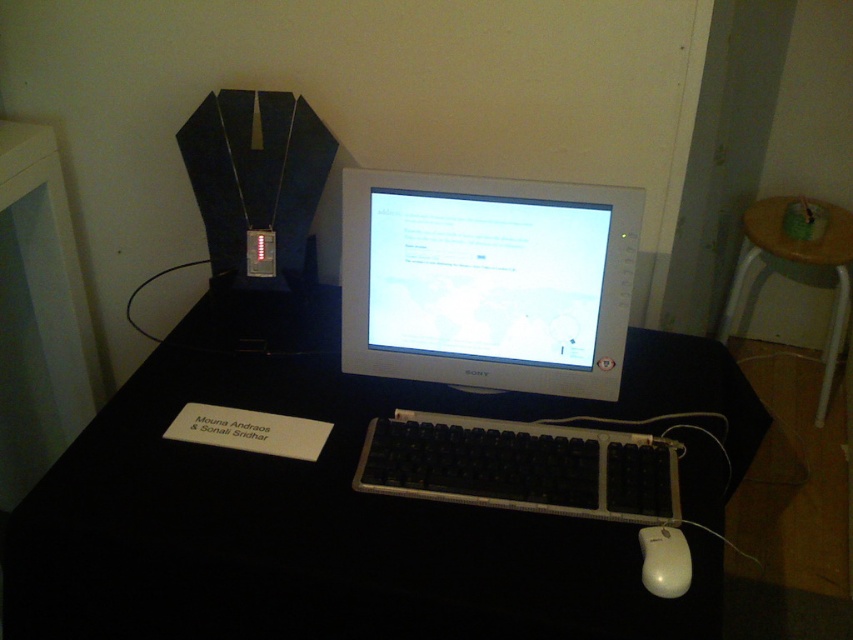
You are organizing your desk and need to move the white plastic mouse at lower right closer to the wooden table at right. Is the mouse currently positioned below the table or to the side of it?

The wooden table at right is above the white plastic mouse at lower right, so the mouse is positioned below the table.

You are sitting at the workspace and want to reach both the point at coordinates point(704, 358) and point(492, 497). Which point is closer to you?

Point(704, 358) is closer to you because it is further to the viewer than point(492, 497).

You are organizing your workspace and need to place a new item on the black plastic computer desk at center. Considering the size of the desk compared to the black plastic keyboard at center, will there be enough space for the item if it is the same size as the keyboard?

The black plastic computer desk at center is larger in size than the black plastic keyboard at center, so there should be enough space to place an item of the same size as the keyboard.